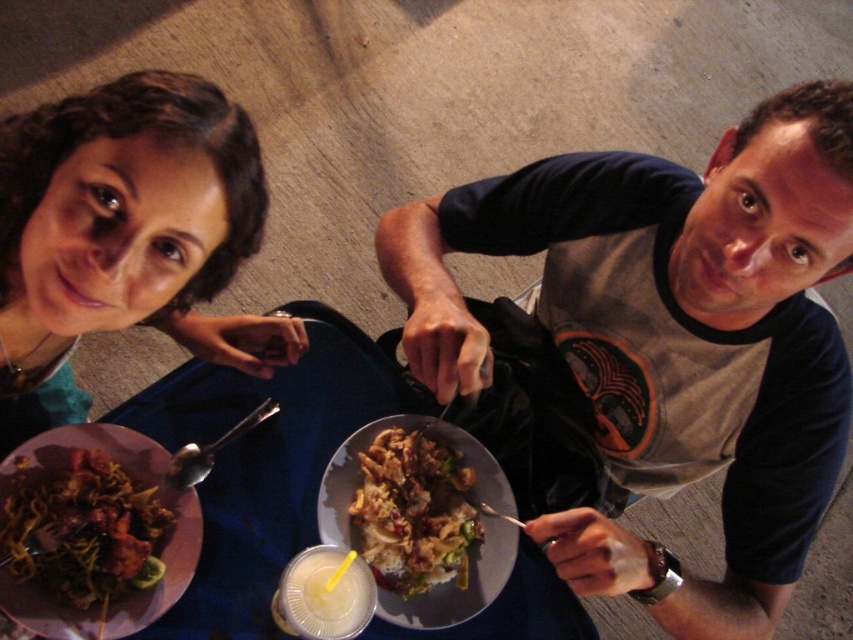
Does point (22, 240) lie behind point (381, 508)?

No, (22, 240) is closer to viewer.

Which is in front, point (51, 289) or point (360, 502)?

Point (51, 289)

This screenshot has height=640, width=853. Identify the location of matte teal shirt at upper left. (123, 234).

You are a GUI agent. You are given a task and a screenshot of the screen. Output one action in this format:
    pyautogui.click(x=<x>, y=<y>)
    Task: Click on the matte teal shirt at upper left
    
    Given the screenshot: What is the action you would take?
    pyautogui.click(x=123, y=234)

What do you see at coordinates (654, 348) in the screenshot? I see `gray cotton t-shirt at upper right` at bounding box center [654, 348].

Can you confirm if gray cotton t-shirt at upper right is bigger than matte teal shirt at upper left?

Correct, gray cotton t-shirt at upper right is larger in size than matte teal shirt at upper left.

What do you see at coordinates (654, 348) in the screenshot? I see `gray cotton t-shirt at upper right` at bounding box center [654, 348].

The width and height of the screenshot is (853, 640). I want to click on gray cotton t-shirt at upper right, so click(654, 348).

Which is behind, point (469, 228) or point (296, 484)?

The point (469, 228) is more distant.

Does gray cotton t-shirt at upper right lie behind blue fabric table at center?

No.

Is point (814, 157) more distant than point (229, 532)?

No.

The width and height of the screenshot is (853, 640). I want to click on gray cotton t-shirt at upper right, so click(654, 348).